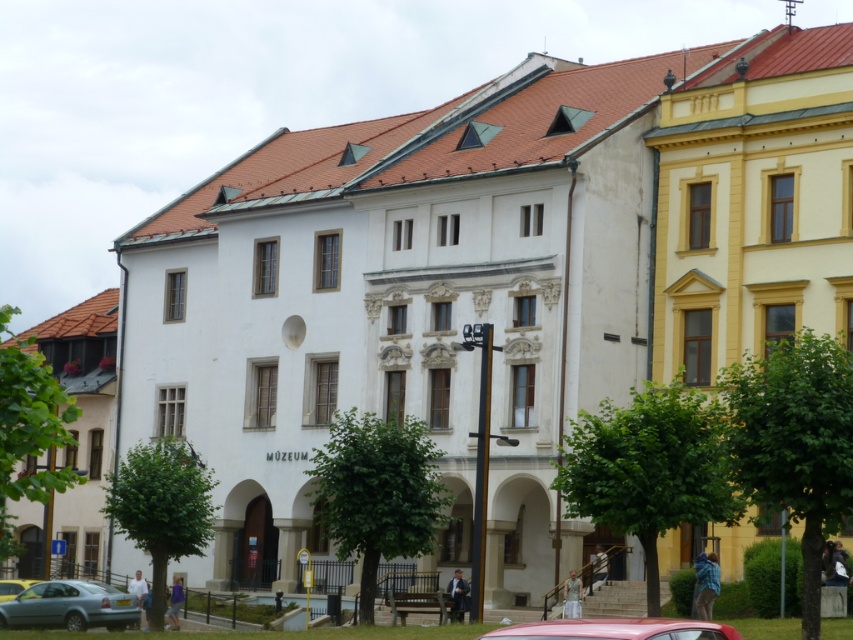
Question: Does metallic pink car at lower center appear on the right side of metallic silver car at lower left?

Choices:
 (A) no
 (B) yes

Answer: (B)

Question: Can you confirm if metallic pink car at lower center is smaller than metallic silver car at lower left?

Choices:
 (A) no
 (B) yes

Answer: (A)

Question: Which point is farther to the camera?

Choices:
 (A) metallic silver car at lower left
 (B) metallic pink car at lower center
 (C) light blue metallic car at lower left

Answer: (A)

Question: Where is light blue metallic car at lower left located in relation to metallic silver car at lower left in the image?

Choices:
 (A) right
 (B) left

Answer: (A)

Question: Which point is farther to the camera?

Choices:
 (A) light blue metallic car at lower left
 (B) metallic pink car at lower center
 (C) metallic silver car at lower left

Answer: (C)

Question: Which point is farther to the camera?

Choices:
 (A) metallic silver car at lower left
 (B) light blue metallic car at lower left

Answer: (A)